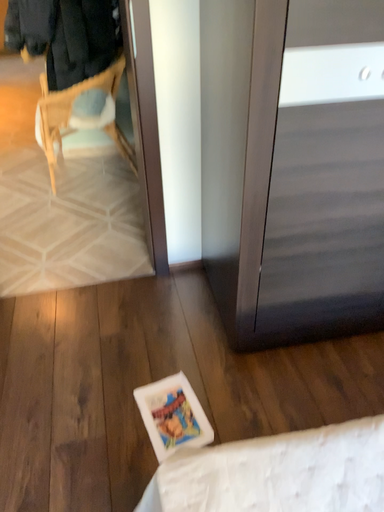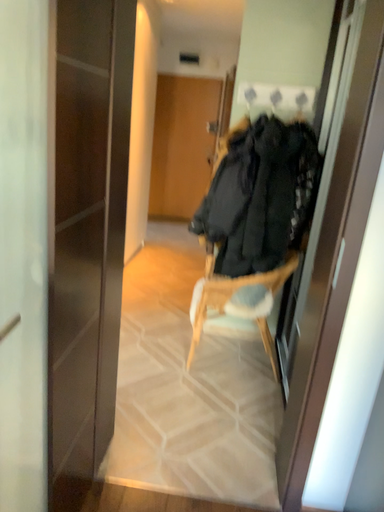
Question: Which way did the camera rotate in the video?

Choices:
 (A) rotated downward
 (B) rotated upward

Answer: (B)